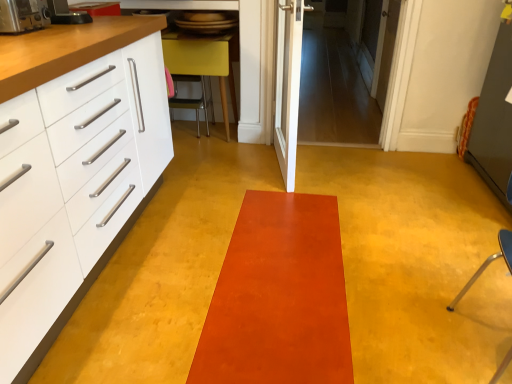
The height and width of the screenshot is (384, 512). In order to click on vacant space behind blue plastic chair at right, which ranks as the 1th furniture in bottom-to-top order in this screenshot , I will do `click(439, 278)`.